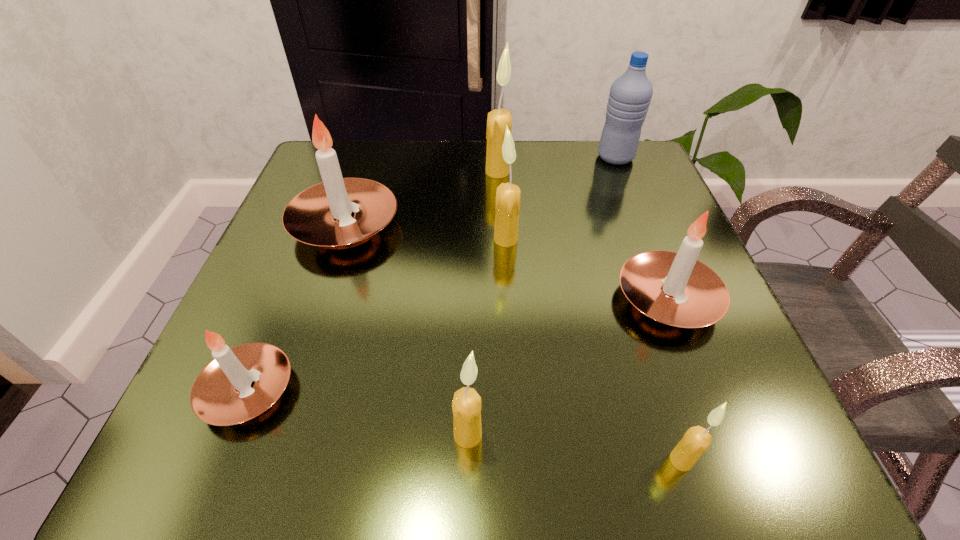
You are a GUI agent. You are given a task and a screenshot of the screen. Output one action in this format:
    pyautogui.click(x=<x>, y=<y>)
    Task: Click on the free spot that satisfies the following two spatial constraints: 1. on the front side of the rightmost cream candle; 2. on the right side of the third nearest cream candle
    The height and width of the screenshot is (540, 960).
    Given the screenshot: What is the action you would take?
    pyautogui.click(x=519, y=460)

Locate an element on the screen. This screenshot has height=540, width=960. vacant position in the image that satisfies the following two spatial constraints: 1. on the front side of the nearest object; 2. on the left side of the leftmost cream candle is located at coordinates (468, 460).

Identify the location of vacant region that satisfies the following two spatial constraints: 1. on the back side of the tallest object; 2. on the left side of the biggest white candle. The height and width of the screenshot is (540, 960). (363, 172).

Where is `free spot that satisfies the following two spatial constraints: 1. on the front side of the rightmost cream candle; 2. on the right side of the farthest cream candle`? The image size is (960, 540). free spot that satisfies the following two spatial constraints: 1. on the front side of the rightmost cream candle; 2. on the right side of the farthest cream candle is located at coordinates (512, 460).